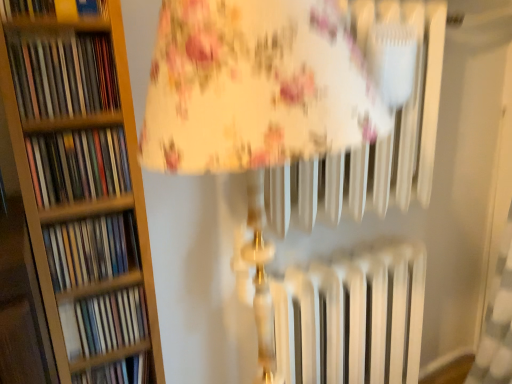
Question: Is multicolored paperbacks at left, the 4th book positioned from the bottom, positioned with its back to matte plastic book at left, the fifth book in the top-to-bottom sequence?

Choices:
 (A) yes
 (B) no

Answer: (B)

Question: From the image's perspective, would you say multicolored paperbacks at left, the 4th book positioned from the bottom, is shown under matte plastic book at left, the 2th book positioned from the bottom?

Choices:
 (A) yes
 (B) no

Answer: (B)

Question: Is multicolored paperbacks at left, the 4th book positioned from the bottom, placed right next to matte plastic book at left, the 2th book positioned from the bottom?

Choices:
 (A) no
 (B) yes

Answer: (A)

Question: Can you confirm if multicolored paperbacks at left, the third book in the top-to-bottom sequence, is taller than matte plastic book at left, the 2th book positioned from the bottom?

Choices:
 (A) no
 (B) yes

Answer: (A)

Question: Is multicolored paperbacks at left, the 4th book positioned from the bottom, surrounding matte plastic book at left, the fifth book in the top-to-bottom sequence?

Choices:
 (A) no
 (B) yes

Answer: (A)

Question: From a real-world perspective, is multicolored paperbacks at left, the third book in the top-to-bottom sequence, below matte plastic book at left, the 2th book positioned from the bottom?

Choices:
 (A) yes
 (B) no

Answer: (B)

Question: Is the position of hardcover book at upper left, the 6th book when ordered from bottom to top, less distant than that of matte plastic books at left, which is counted as the 3th book, starting from the bottom?

Choices:
 (A) no
 (B) yes

Answer: (B)

Question: Is matte plastic books at left, which is the fourth book in top-to-bottom order, inside hardcover book at upper left, the 6th book when ordered from bottom to top?

Choices:
 (A) no
 (B) yes

Answer: (A)

Question: Can you confirm if hardcover book at upper left, the first book from the top, is shorter than matte plastic books at left, which is the fourth book in top-to-bottom order?

Choices:
 (A) no
 (B) yes

Answer: (A)

Question: Can you see hardcover book at upper left, the first book from the top, touching matte plastic books at left, which is counted as the 3th book, starting from the bottom?

Choices:
 (A) no
 (B) yes

Answer: (A)

Question: Considering the relative sizes of hardcover book at upper left, the first book from the top, and matte plastic books at left, which is counted as the 3th book, starting from the bottom, in the image provided, is hardcover book at upper left, the first book from the top, bigger than matte plastic books at left, which is counted as the 3th book, starting from the bottom,?

Choices:
 (A) yes
 (B) no

Answer: (A)

Question: Does hardcover book at upper left, the 6th book when ordered from bottom to top, come behind matte plastic books at left, which is the fourth book in top-to-bottom order?

Choices:
 (A) yes
 (B) no

Answer: (B)

Question: Could you tell me if matte plastic book at left, the fifth book in the top-to-bottom sequence, is facing matte plastic books at left, which is counted as the 5th book, starting from the bottom?

Choices:
 (A) no
 (B) yes

Answer: (A)